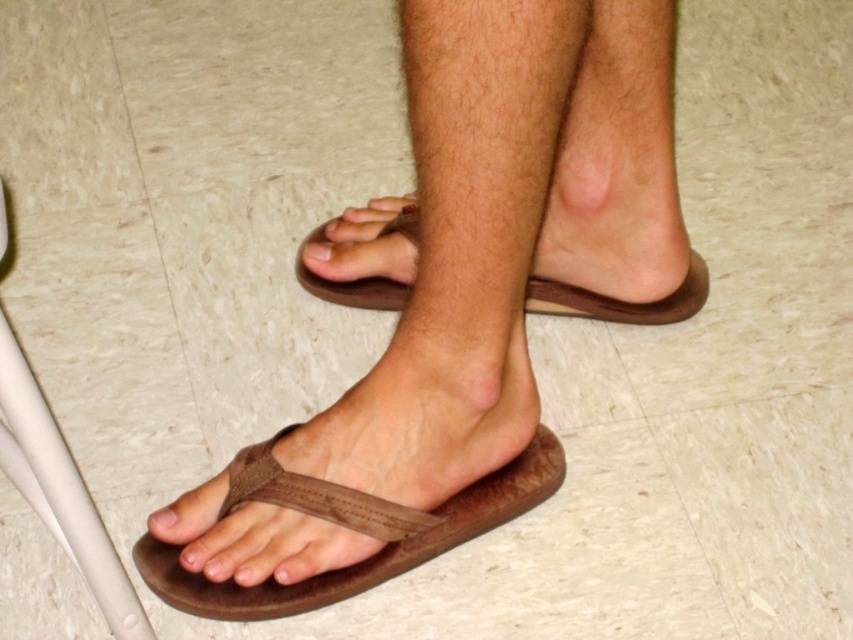
You are a GUI agent. You are given a task and a screenshot of the screen. Output one action in this format:
    pyautogui.click(x=<x>, y=<y>)
    Task: Click on the brown leather flip-flops at center
    The width and height of the screenshot is (853, 640).
    Given the screenshot: What is the action you would take?
    tap(457, 305)

Between brown leather flip-flops at center and matte brown toe at lower left, which one is positioned higher?

brown leather flip-flops at center is higher up.

Between point (599, 225) and point (163, 518), which one is positioned behind?

Point (599, 225)

Where is `brown leather flip-flops at center`? brown leather flip-flops at center is located at coordinates (457, 305).

Does brown leather sandal at lower left have a greater height compared to brown leather toe at center?

Correct, brown leather sandal at lower left is much taller as brown leather toe at center.

Image resolution: width=853 pixels, height=640 pixels. Describe the element at coordinates (347, 528) in the screenshot. I see `brown leather sandal at lower left` at that location.

Describe the element at coordinates (347, 528) in the screenshot. I see `brown leather sandal at lower left` at that location.

Find the location of `brown leather sandal at lower left`. brown leather sandal at lower left is located at coordinates (347, 528).

Does brown leather flip-flops at center appear on the right side of brown leather sandal at lower left?

Correct, you'll find brown leather flip-flops at center to the right of brown leather sandal at lower left.

This screenshot has height=640, width=853. Describe the element at coordinates (457, 305) in the screenshot. I see `brown leather flip-flops at center` at that location.

At what (x,y) coordinates should I click in order to perform the action: click on brown leather flip-flops at center. Please return your answer as a coordinate pair (x, y). This screenshot has height=640, width=853. Looking at the image, I should click on (457, 305).